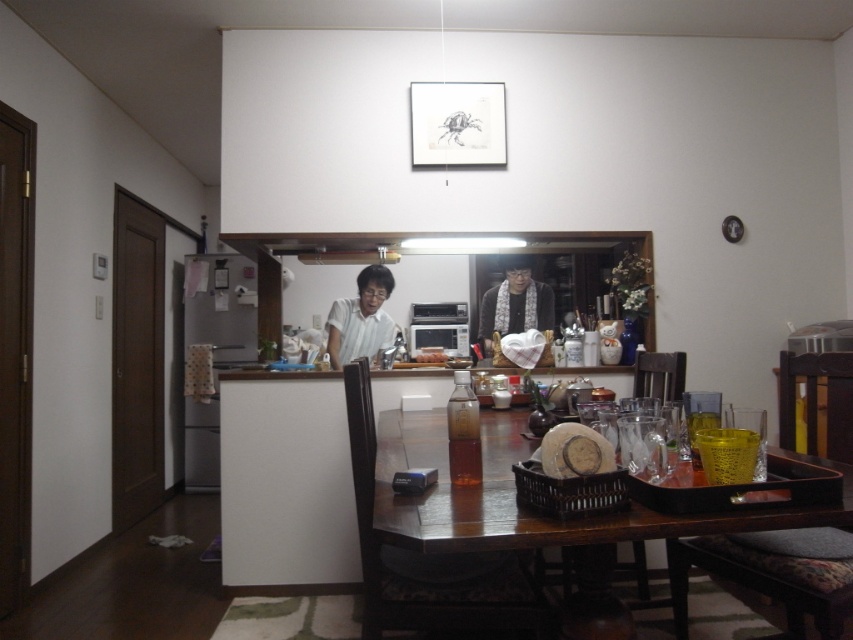
Question: Can you confirm if wooden table at center is wider than wooden chair at lower right?

Choices:
 (A) yes
 (B) no

Answer: (A)

Question: Among these points, which one is farthest from the camera?

Choices:
 (A) (538, 288)
 (B) (537, 582)
 (C) (749, 548)
 (D) (363, 324)

Answer: (A)

Question: Considering the relative positions of brown wooden chair at center and wooden cushioned chair at right in the image provided, where is brown wooden chair at center located with respect to wooden cushioned chair at right?

Choices:
 (A) left
 (B) right

Answer: (A)

Question: Is brown wooden chair at center to the left of wooden chair at lower right from the viewer's perspective?

Choices:
 (A) no
 (B) yes

Answer: (B)

Question: Which point appears closest to the camera in this image?

Choices:
 (A) (672, 378)
 (B) (486, 445)

Answer: (B)

Question: Among these points, which one is farthest from the camera?

Choices:
 (A) (844, 602)
 (B) (517, 282)
 (C) (676, 380)
 (D) (392, 340)

Answer: (B)